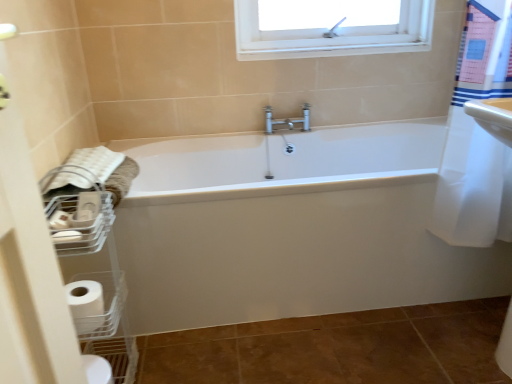
Identify the location of vacant area on top of white soft towel at left (from a real-world perspective). Image resolution: width=512 pixels, height=384 pixels. (87, 160).